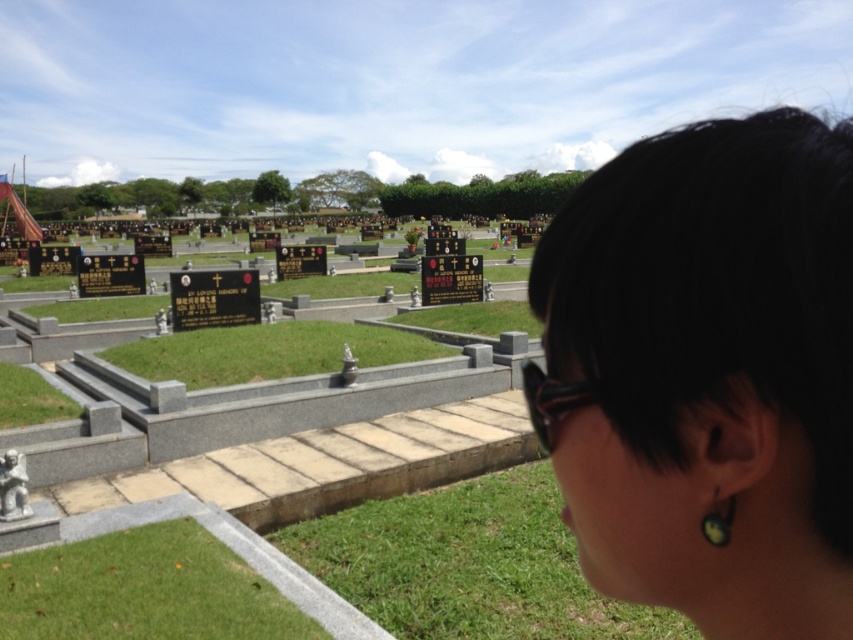
Question: Which point is farther to the camera?

Choices:
 (A) (625, 588)
 (B) (706, 524)

Answer: (A)

Question: Which object appears closest to the camera in this image?

Choices:
 (A) green matte earring at lower right
 (B) black hair at upper right

Answer: (B)

Question: Is black hair at upper right positioned behind green matte earring at lower right?

Choices:
 (A) yes
 (B) no

Answer: (B)

Question: Among these objects, which one is farthest from the camera?

Choices:
 (A) green matte earring at lower right
 (B) black hair at upper right

Answer: (A)

Question: Is black hair at upper right behind green matte earring at lower right?

Choices:
 (A) no
 (B) yes

Answer: (A)

Question: Does black hair at upper right appear over green matte earring at lower right?

Choices:
 (A) no
 (B) yes

Answer: (B)